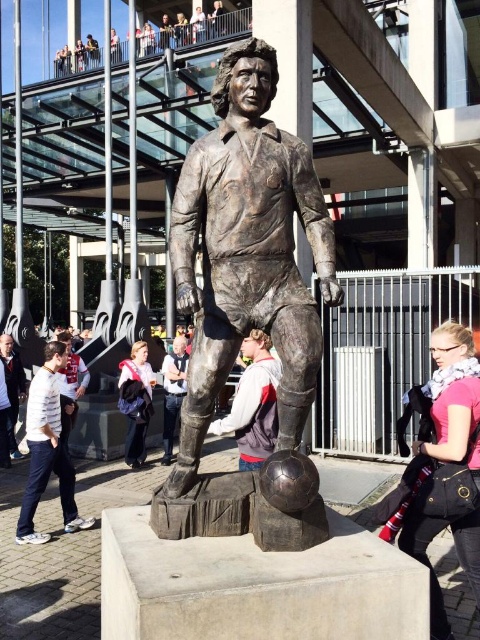
What is located at the coordinate point (48, 451) in the image?

The white cotton shirt at lower left is located at point (48, 451).

You are an artist observing the statue and its surroundings. You notice the white cotton shirt at lower left and the light brown leather jacket at center. Which object appears taller in the image?

The white cotton shirt at lower left is taller than the light brown leather jacket at center according to the description.